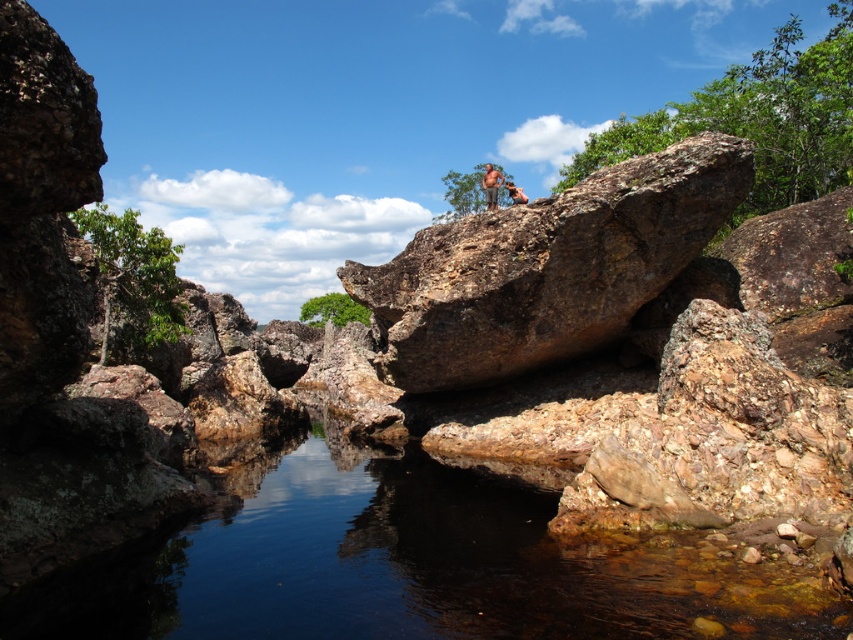
You are planning to cross the clear water at center to reach the brown textured shorts at upper center. Based on their widths, which one is wider?

The clear water at center is wider than the brown textured shorts at upper center, so the clear water at center is wider.

Based on the photo, you are standing on the rock outcrop and want to find the clear water at center. According to the coordinates provided, in which direction should you move relative to your current position?

The clear water at center is located at coordinates point (412, 566). Since the person is on the rock outcrop, moving towards the center of the image where the clear water at center is situated would be the correct direction.